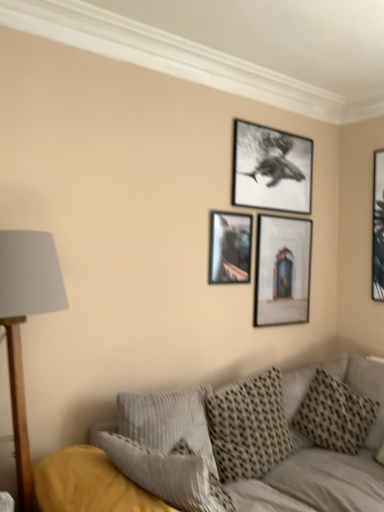
Question: Relative to matte wooden picture frame at center, which ranks as the 2th picture frame in right-to-left order, is metallic silver picture frame at center, which ranks as the 4th picture frame in right-to-left order, in front or behind?

Choices:
 (A) front
 (B) behind

Answer: (A)

Question: Looking at their shapes, would you say metallic silver picture frame at center, placed as the first picture frame when sorted from left to right, is wider or thinner than matte wooden picture frame at center, the third picture frame when ordered from left to right?

Choices:
 (A) thin
 (B) wide

Answer: (A)

Question: Which of these objects is positioned farthest from the matte black picture frame at right, arranged as the 4th picture frame when viewed from the left?

Choices:
 (A) black matte picture frame at upper center, the 3th picture frame in the right-to-left sequence
 (B) wooden base with gray fabric lampshade at left
 (C) textured gray pillow at lower center, which is counted as the third pillow, starting from the right
 (D) textured gray couch at lower right
 (E) matte wooden picture frame at center, the third picture frame when ordered from left to right

Answer: (B)

Question: Estimate the real-world distances between objects in this image. Which object is closer to the matte wooden picture frame at center, the third picture frame when ordered from left to right?

Choices:
 (A) textured gray couch at lower right
 (B) patterned fabric pillow at center, arranged as the second pillow when viewed from the left
 (C) black matte picture frame at upper center, positioned as the second picture frame in left-to-right order
 (D) matte black picture frame at right, the first picture frame positioned from the right
 (E) patterned fabric pillow at right, the 1th pillow positioned from the right

Answer: (C)